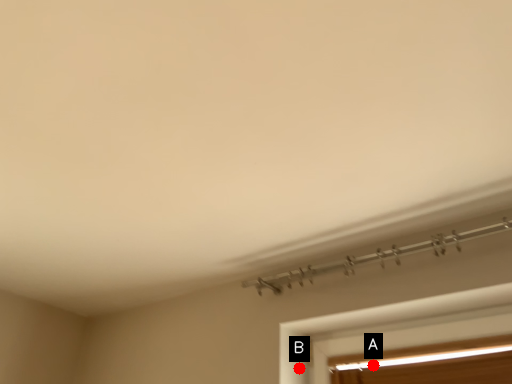
Question: Two points are circled on the image, labeled by A and B beside each circle. Which point is closer to the camera taking this photo?

Choices:
 (A) A is closer
 (B) B is closer

Answer: (A)